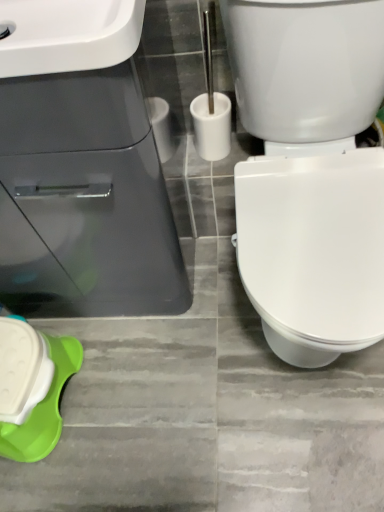
Question: Can you confirm if white glossy sink at upper left, which is counted as the 1th sink, starting from the back, is smaller than white plastic toilet brush at center?

Choices:
 (A) no
 (B) yes

Answer: (A)

Question: Does white glossy sink at upper left, which appears as the 2th sink when viewed from the front, have a greater height compared to white plastic toilet brush at center?

Choices:
 (A) yes
 (B) no

Answer: (A)

Question: Is white glossy sink at upper left, which appears as the 2th sink when viewed from the front, turned away from white plastic toilet brush at center?

Choices:
 (A) yes
 (B) no

Answer: (B)

Question: Is white glossy sink at upper left, which appears as the 2th sink when viewed from the front, to the left of white plastic toilet brush at center from the viewer's perspective?

Choices:
 (A) no
 (B) yes

Answer: (B)

Question: Can white plastic toilet brush at center be found inside white glossy sink at upper left, which appears as the 2th sink when viewed from the front?

Choices:
 (A) no
 (B) yes

Answer: (A)

Question: Considering the positions of point (221, 152) and point (44, 60), is point (221, 152) closer or farther from the camera than point (44, 60)?

Choices:
 (A) closer
 (B) farther

Answer: (B)

Question: Considering the relative positions of white plastic toilet brush at center and white glossy sink at upper left, which is counted as the 1th sink, starting from the front, in the image provided, is white plastic toilet brush at center to the left or to the right of white glossy sink at upper left, which is counted as the 1th sink, starting from the front,?

Choices:
 (A) right
 (B) left

Answer: (A)

Question: From the image's perspective, is white plastic toilet brush at center positioned above or below white glossy sink at upper left, which is counted as the 1th sink, starting from the front?

Choices:
 (A) below
 (B) above

Answer: (A)

Question: Based on their sizes in the image, would you say white plastic toilet brush at center is bigger or smaller than white glossy sink at upper left, which is counted as the 1th sink, starting from the front?

Choices:
 (A) small
 (B) big

Answer: (A)

Question: Is white glossy sink at upper left, which appears as the 2th sink when viewed from the front, inside or outside of white plastic toilet brush at center?

Choices:
 (A) inside
 (B) outside

Answer: (B)

Question: From a real-world perspective, relative to white plastic toilet brush at center, is white glossy sink at upper left, which is counted as the 1th sink, starting from the back, vertically above or below?

Choices:
 (A) above
 (B) below

Answer: (B)

Question: Is white glossy sink at upper left, which appears as the 2th sink when viewed from the front, to the left or to the right of white plastic toilet brush at center in the image?

Choices:
 (A) left
 (B) right

Answer: (A)

Question: In terms of height, does white glossy sink at upper left, which is counted as the 1th sink, starting from the back, look taller or shorter compared to white plastic toilet brush at center?

Choices:
 (A) short
 (B) tall

Answer: (B)

Question: Is point (124, 30) positioned closer to the camera than point (28, 451)?

Choices:
 (A) farther
 (B) closer

Answer: (B)

Question: Is white glossy sink at upper left, which is counted as the 1th sink, starting from the front, in front of or behind green plastic container at lower left in the image?

Choices:
 (A) behind
 (B) front

Answer: (B)